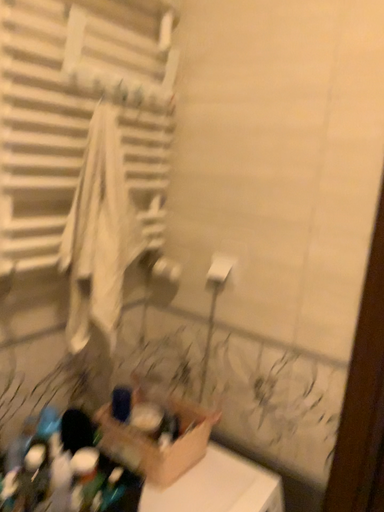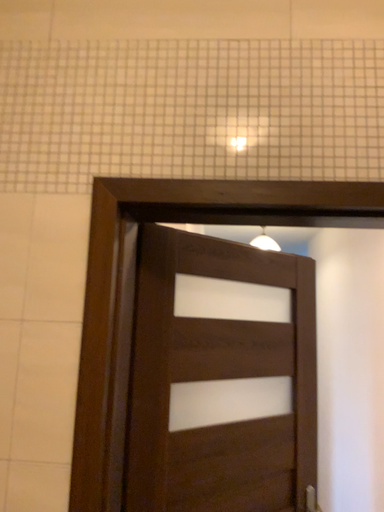
Question: How did the camera likely rotate when shooting the video?

Choices:
 (A) rotated left
 (B) rotated right

Answer: (B)